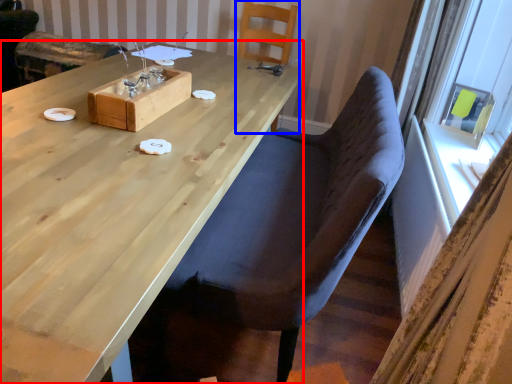
Question: Which point is closer to the camera, table (highlighted by a red box) or chair (highlighted by a blue box)?

Choices:
 (A) table
 (B) chair

Answer: (A)